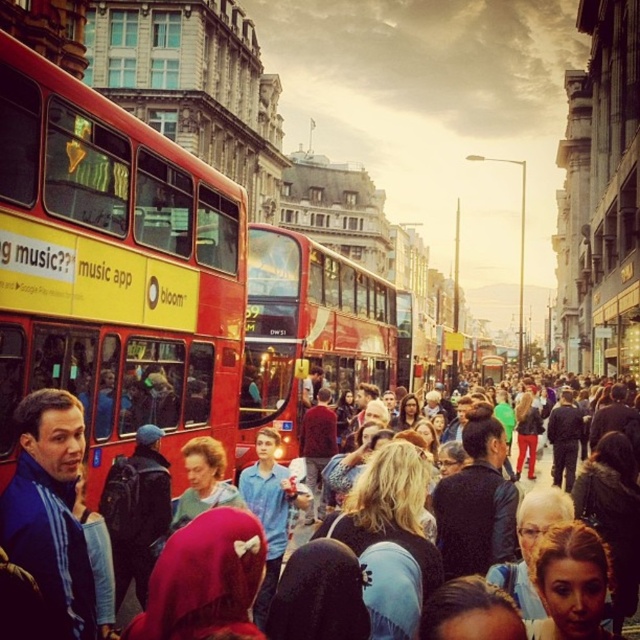
Question: Where is red double-decker bus at center located in relation to matte red bus at center in the image?

Choices:
 (A) right
 (B) left

Answer: (B)

Question: Which object is farther from the camera taking this photo?

Choices:
 (A) red double-decker bus at center
 (B) matte yellow double-decker bus at left

Answer: (A)

Question: Is matte yellow double-decker bus at left further to the viewer compared to matte red bus at center?

Choices:
 (A) yes
 (B) no

Answer: (B)

Question: Does matte yellow double-decker bus at left appear on the right side of red double-decker bus at center?

Choices:
 (A) no
 (B) yes

Answer: (A)

Question: Which point is farther to the camera?

Choices:
 (A) (256, 323)
 (B) (65, 316)

Answer: (A)

Question: Which object is positioned farthest from the matte red bus at center?

Choices:
 (A) red double-decker bus at center
 (B) matte yellow double-decker bus at left

Answer: (B)